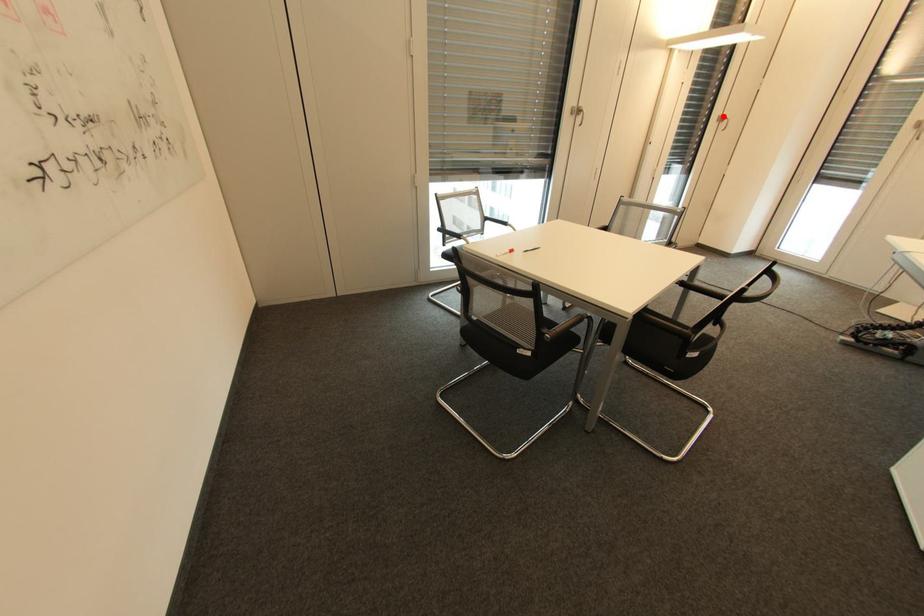
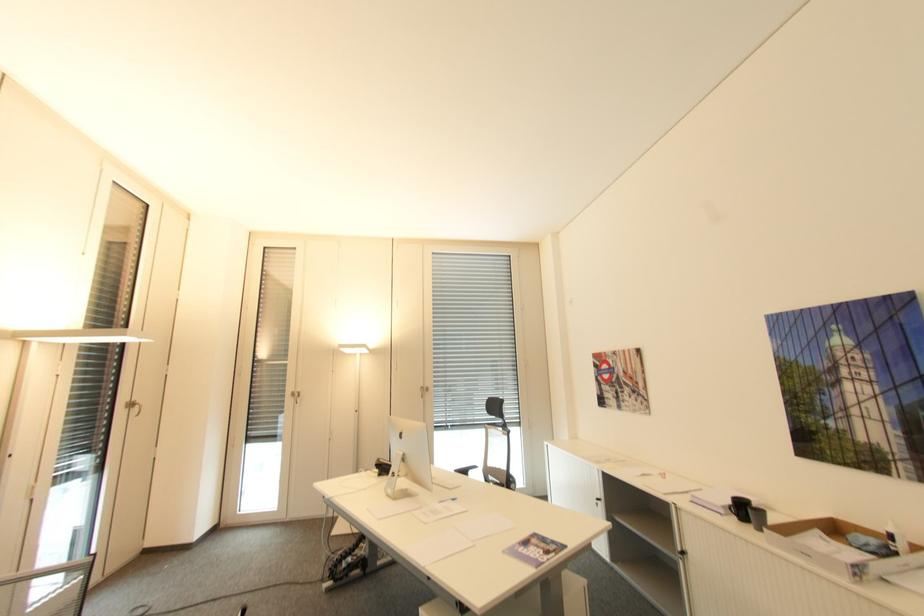
Locate, in the second image, the point that corresponds to the highlighted location in the first image.

(131, 402)